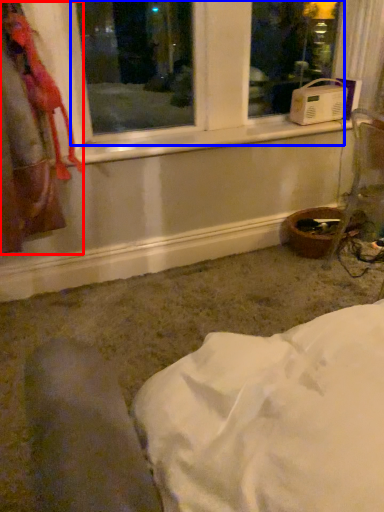
Question: Which of the following is the farthest to the observer, laundry (highlighted by a red box) or bay window (highlighted by a blue box)?

Choices:
 (A) laundry
 (B) bay window

Answer: (B)